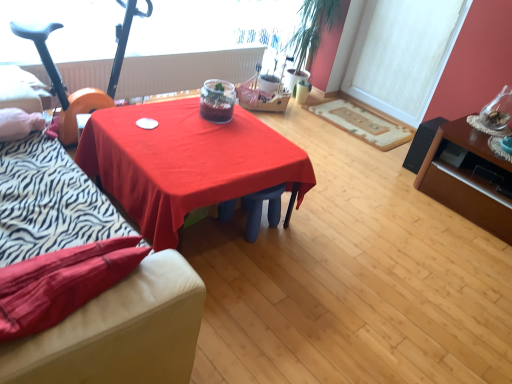
Question: Is velvet-like red couch at lower left to the left or to the right of matte red tablecloth at center, which ranks as the 1th table in left-to-right order, in the image?

Choices:
 (A) left
 (B) right

Answer: (A)

Question: From a real-world perspective, is velvet-like red couch at lower left above or below matte red tablecloth at center, which ranks as the 1th table in left-to-right order?

Choices:
 (A) above
 (B) below

Answer: (A)

Question: Estimate the real-world distances between objects in this image. Which object is farther from the white textured window screen at upper right?

Choices:
 (A) matte black speaker at right, acting as the 1th table starting from the right
 (B) white textured radiator at upper center
 (C) velvet-like red couch at lower left
 (D) translucent glass jar at center
 (E) orange rubber baby carriage at left

Answer: (C)

Question: Which object is the closest to the white textured radiator at upper center?

Choices:
 (A) translucent glass jar at center
 (B) green leafy plant at upper right
 (C) matte black speaker at right, acting as the 1th table starting from the right
 (D) matte red tablecloth at center, which ranks as the 1th table in left-to-right order
 (E) beige carpet at lower center

Answer: (B)